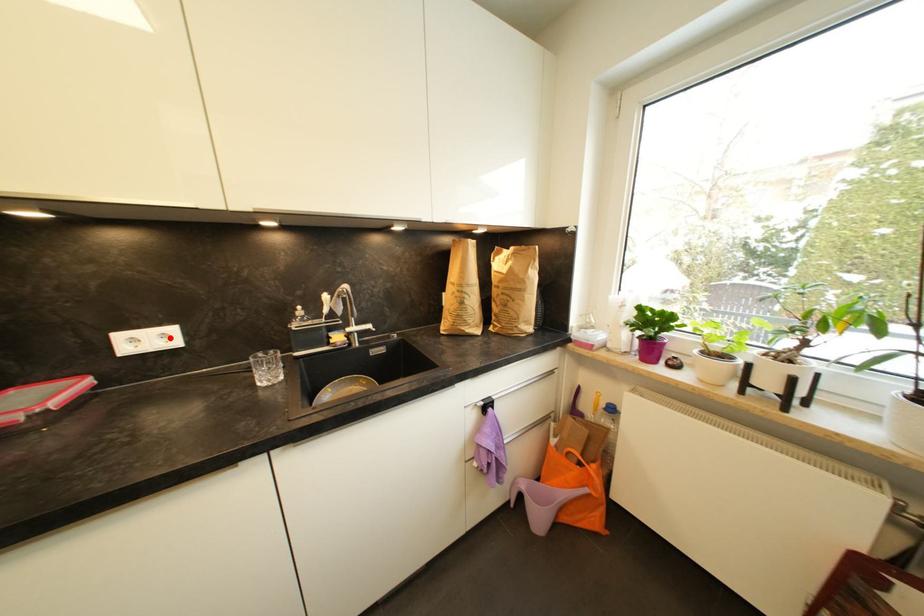
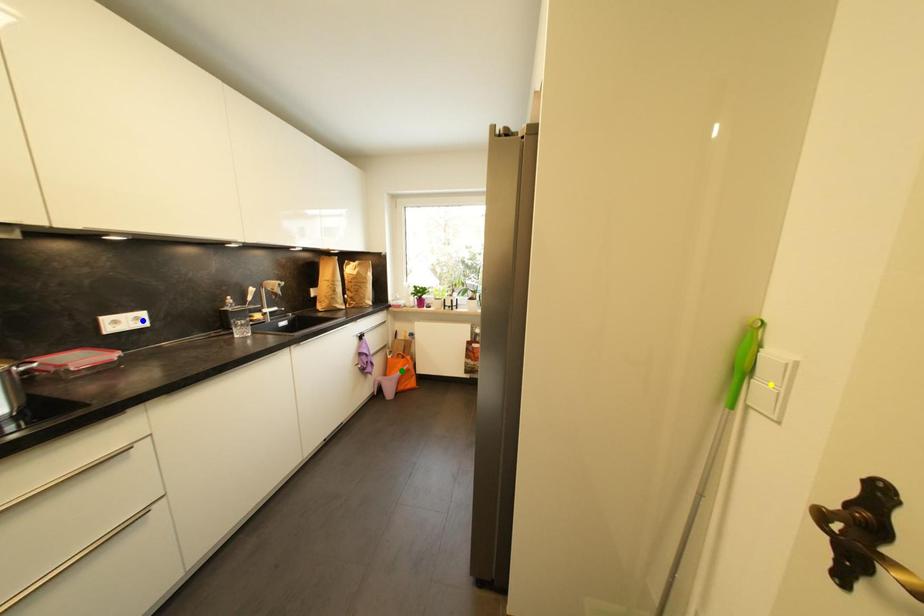
Question: I am providing you with two images of the same scene from different viewpoints. A red point is marked on the first image. You are given multiple points on the second image. In image 2, which mark is for the same physical point as the one in image 1?

Choices:
 (A) yellow point
 (B) blue point
 (C) green point

Answer: (B)